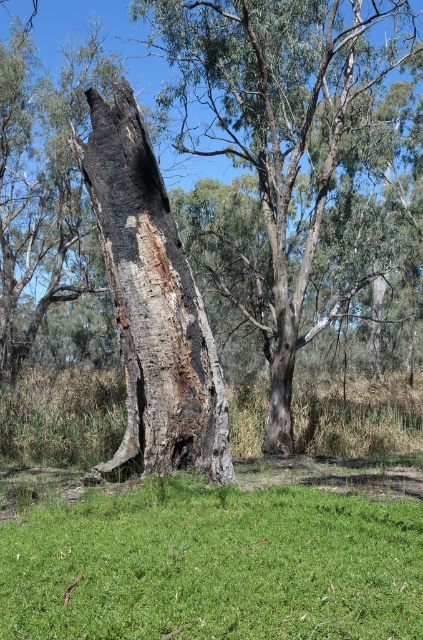
Is charcoal bark tree at left smaller than charcoal rough bark tree trunk at center?

Incorrect, charcoal bark tree at left is not smaller in size than charcoal rough bark tree trunk at center.

Which of these two, charcoal bark tree at left or charcoal rough bark tree trunk at center, stands taller?

charcoal bark tree at left is taller.

Between point (271, 410) and point (194, 333), which one is positioned behind?

The point (271, 410) is more distant.

The width and height of the screenshot is (423, 640). I want to click on charcoal bark tree at left, so click(x=279, y=124).

Who is positioned more to the left, green grass at center or charcoal bark tree at left?

From the viewer's perspective, green grass at center appears more on the left side.

Does green grass at center appear on the right side of charcoal bark tree at left?

In fact, green grass at center is to the left of charcoal bark tree at left.

Does point (60, 528) lie behind point (230, 38)?

No.

Identify the location of green grass at center. This screenshot has height=640, width=423. (213, 564).

Does green grass at center have a lesser width compared to charcoal rough bark tree trunk at center?

No.

Does green grass at center have a smaller size compared to charcoal rough bark tree trunk at center?

Correct, green grass at center occupies less space than charcoal rough bark tree trunk at center.

Between point (51, 637) and point (170, 396), which one is positioned in front?

Point (51, 637) is in front.

At what (x,y) coordinates should I click in order to perform the action: click on green grass at center. Please return your answer as a coordinate pair (x, y). The height and width of the screenshot is (640, 423). Looking at the image, I should click on coord(213,564).